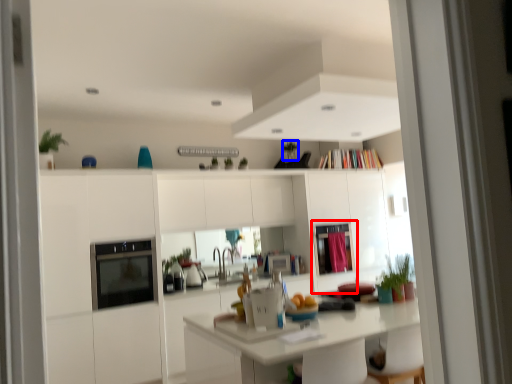
Question: Which point is closer to the camera, screen door (highlighted by a red box) or plant (highlighted by a blue box)?

Choices:
 (A) screen door
 (B) plant

Answer: (A)